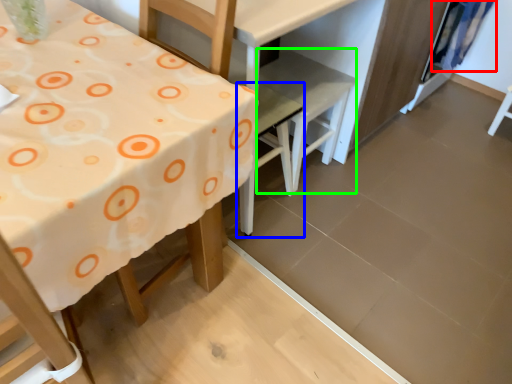
Question: Estimate the real-world distances between objects in this image. Which object is farther from curtain (highlighted by a red box), chair (highlighted by a blue box) or chair (highlighted by a green box)?

Choices:
 (A) chair
 (B) chair

Answer: (A)